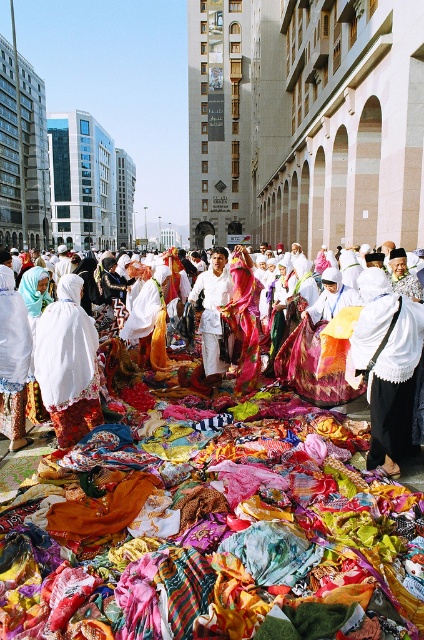
You are standing in the bustling urban area near the religious site and see two points marked in the scene. Which point, point (373, 448) or point (60, 445), is closer to you?

Point (373, 448) is closer to the viewer than point (60, 445).

You are a photographer trying to capture a shot of both the white fabric dress at center and the white cotton shirt at center. Since you want them both in frame, which one should you position to your left to ensure they are both visible?

You should position the white fabric dress at center to your left because it is already to the left of the white cotton shirt at center, so placing it on your left will keep them both in frame.